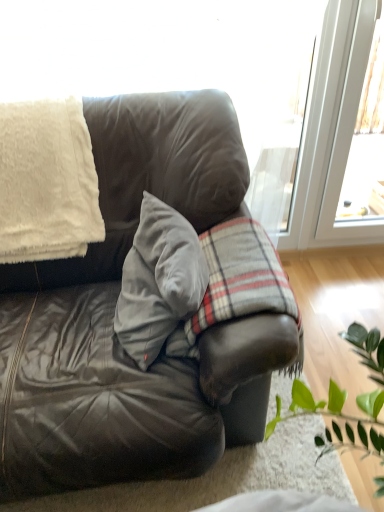
Where is `white fluffy blanket at upper left`? white fluffy blanket at upper left is located at coordinates (47, 182).

You are a GUI agent. You are given a task and a screenshot of the screen. Output one action in this format:
    pyautogui.click(x=<x>, y=<y>)
    Task: Click on the plaid fabric at center
    This screenshot has height=512, width=384.
    Given the screenshot: What is the action you would take?
    click(x=236, y=282)

Locate an element on the screen. The width and height of the screenshot is (384, 512). leather couch at center is located at coordinates (113, 313).

Locate an element on the screen. This screenshot has width=384, height=512. white fluffy blanket at upper left is located at coordinates (47, 182).

Consider the image. How different are the orientations of plaid fabric at center and leather couch at center in degrees?

The angular difference between plaid fabric at center and leather couch at center is 85 degrees.

Is plaid fabric at center next to leather couch at center and touching it?

No, plaid fabric at center is not beside leather couch at center.

Based on the photo, between plaid fabric at center and leather couch at center, which one is positioned in front?

leather couch at center is closer to the camera.

Do you think velvet gray pillow at center is within leather couch at center, or outside of it?

velvet gray pillow at center can be found inside leather couch at center.

Does velvet gray pillow at center touch leather couch at center?

They are not placed beside each other.

Is velvet gray pillow at center taller or shorter than leather couch at center?

Considering their sizes, velvet gray pillow at center has less height than leather couch at center.

From the image's perspective, between velvet gray pillow at center and leather couch at center, who is located below?

leather couch at center.

Does velvet gray pillow at center have a greater width compared to plaid fabric at center?

Incorrect, the width of velvet gray pillow at center does not surpass that of plaid fabric at center.

Is plaid fabric at center located within velvet gray pillow at center?

Definitely not — plaid fabric at center is not inside velvet gray pillow at center.

Identify the location of throw pillow on the left of plaid fabric at center. (158, 281).

Does velvet gray pillow at center appear on the right side of plaid fabric at center?

In fact, velvet gray pillow at center is to the left of plaid fabric at center.

In terms of width, does plaid fabric at center look wider or thinner when compared to velvet gray pillow at center?

Considering their sizes, plaid fabric at center looks broader than velvet gray pillow at center.

The image size is (384, 512). In order to click on throw pillow lying above the plaid fabric at center (from the image's perspective) in this screenshot , I will do `click(158, 281)`.

Is plaid fabric at center aimed at velvet gray pillow at center?

No, plaid fabric at center is not turned towards velvet gray pillow at center.

Which is behind, point (240, 268) or point (151, 344)?

Positioned behind is point (240, 268).

Is white fluffy blanket at upper left taller than velvet gray pillow at center?

Indeed, white fluffy blanket at upper left has a greater height compared to velvet gray pillow at center.

From a real-world perspective, which object stands above the other?

white fluffy blanket at upper left, from a real-world perspective.

Would you say white fluffy blanket at upper left is outside velvet gray pillow at center?

white fluffy blanket at upper left is positioned outside velvet gray pillow at center.

Looking at their sizes, would you say white fluffy blanket at upper left is wider or thinner than velvet gray pillow at center?

white fluffy blanket at upper left is wider than velvet gray pillow at center.

Is plaid fabric at center taller or shorter than white fluffy blanket at upper left?

In the image, plaid fabric at center appears to be taller than white fluffy blanket at upper left.

Which is behind, plaid fabric at center or white fluffy blanket at upper left?

white fluffy blanket at upper left is behind.

Image resolution: width=384 pixels, height=512 pixels. I want to click on throw pillow above the leather couch at center (from a real-world perspective), so click(158, 281).

Does leather couch at center touch velvet gray pillow at center?

No, leather couch at center is not in contact with velvet gray pillow at center.

Is point (140, 440) less distant than point (190, 256)?

Yes, it is in front of point (190, 256).

From a real-world perspective, relative to velvet gray pillow at center, is leather couch at center vertically above or below?

leather couch at center is below velvet gray pillow at center.

At what (x,y) coordinates should I click in order to perform the action: click on plaid on the right side of leather couch at center. Please return your answer as a coordinate pair (x, y). This screenshot has width=384, height=512. Looking at the image, I should click on (236, 282).

At what (x,y) coordinates should I click in order to perform the action: click on throw pillow above the leather couch at center (from a real-world perspective). Please return your answer as a coordinate pair (x, y). This screenshot has height=512, width=384. Looking at the image, I should click on (158, 281).

Considering their positions, is velvet gray pillow at center positioned further to leather couch at center than plaid fabric at center?

The object further to leather couch at center is plaid fabric at center.

Which object lies further to the anchor point leather couch at center, white fluffy blanket at upper left or plaid fabric at center?

white fluffy blanket at upper left lies further to leather couch at center than the other object.

Considering their positions, is velvet gray pillow at center positioned further to leather couch at center than white fluffy blanket at upper left?

white fluffy blanket at upper left.

Based on their spatial positions, is velvet gray pillow at center or white fluffy blanket at upper left further from plaid fabric at center?

white fluffy blanket at upper left.

Looking at the image, which one is located further to velvet gray pillow at center, leather couch at center or plaid fabric at center?

leather couch at center.

Considering their positions, is plaid fabric at center positioned further to velvet gray pillow at center than white fluffy blanket at upper left?

white fluffy blanket at upper left lies further to velvet gray pillow at center than the other object.

When comparing their distances from plaid fabric at center, does velvet gray pillow at center or leather couch at center seem further?

leather couch at center is positioned further to the anchor plaid fabric at center.

Which object lies further to the anchor point velvet gray pillow at center, leather couch at center or white fluffy blanket at upper left?

Based on the image, white fluffy blanket at upper left appears to be further to velvet gray pillow at center.

Find the location of a particular element. throw pillow between leather couch at center and plaid fabric at center in the front-back direction is located at coordinates (158, 281).

This screenshot has height=512, width=384. What are the coordinates of `throw pillow positioned between leather couch at center and white fluffy blanket at upper left from near to far` in the screenshot? It's located at (158, 281).

Where is `studio couch between white fluffy blanket at upper left and plaid fabric at center in the horizontal direction`? The height and width of the screenshot is (512, 384). studio couch between white fluffy blanket at upper left and plaid fabric at center in the horizontal direction is located at coordinates (113, 313).

The width and height of the screenshot is (384, 512). In order to click on throw pillow between white fluffy blanket at upper left and plaid fabric at center in this screenshot , I will do `click(158, 281)`.